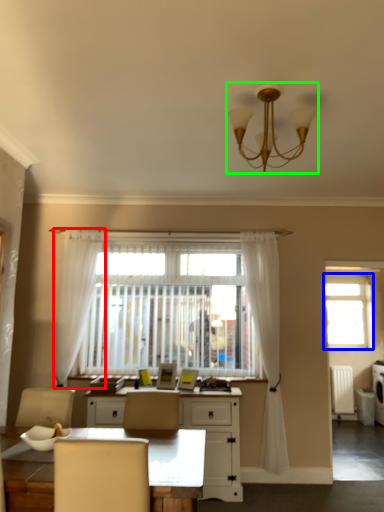
Question: Which object is the farthest from curtain (highlighted by a red box)? Choose among these: window (highlighted by a blue box) or lamp (highlighted by a green box).

Choices:
 (A) window
 (B) lamp

Answer: (A)